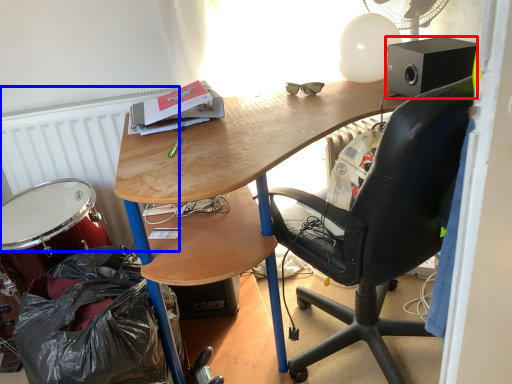
Question: Which object is further to the camera taking this photo, loudspeaker (highlighted by a red box) or radiator (highlighted by a blue box)?

Choices:
 (A) loudspeaker
 (B) radiator

Answer: (B)